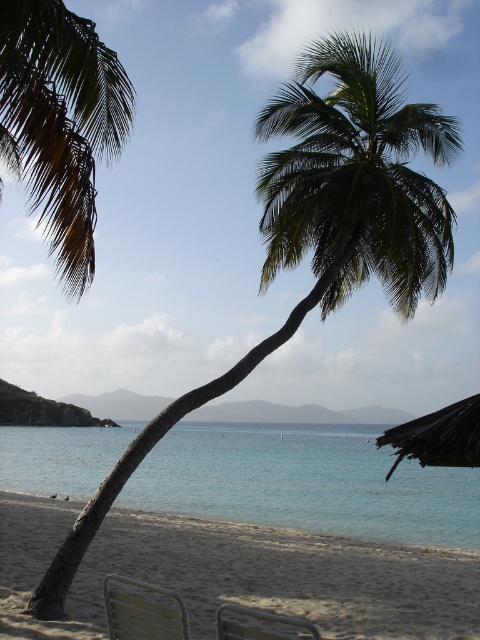
You are a photographer setting up equipment on the beach. You have a tripod that requires a stable surface. Which area between the sandy beige at lower left and the metallic silver chair at lower center would provide a more stable base for your tripod?

The sandy beige at lower left has a greater height compared to the metallic silver chair at lower center, so it would provide a more stable base for your tripod since higher ground is typically more stable on a beach.